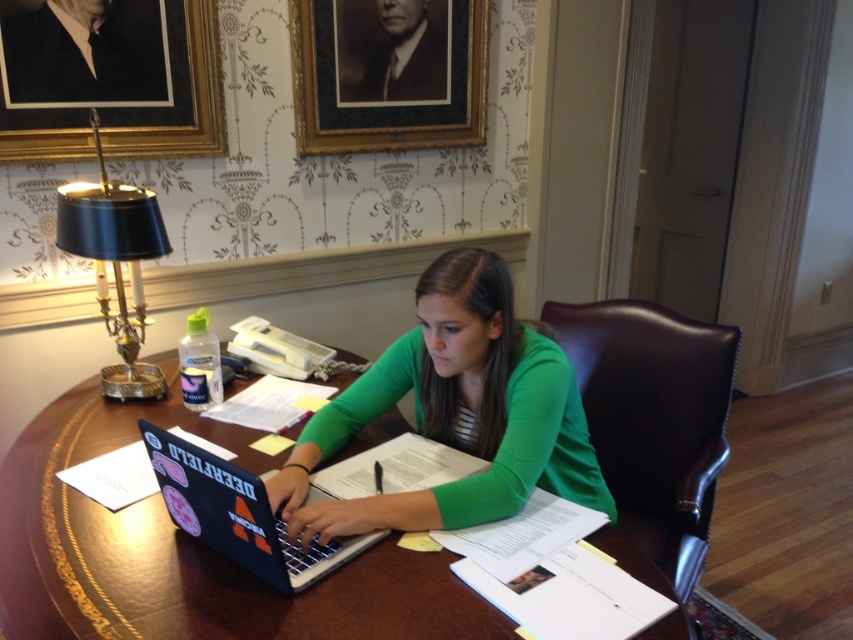
Can you confirm if wooden table at center is taller than matte black laptop at center?

Yes.

Does wooden table at center have a greater width compared to matte black laptop at center?

Yes.

Is point (49, 518) closer to viewer compared to point (207, 525)?

No, (49, 518) is further to viewer.

I want to click on wooden table at center, so click(187, 554).

Does gold framed portrait at upper center appear on the right side of gold/gilded picture frame at upper center?

Indeed, gold framed portrait at upper center is positioned on the right side of gold/gilded picture frame at upper center.

Can you confirm if gold framed portrait at upper center is smaller than gold/gilded picture frame at upper center?

Actually, gold framed portrait at upper center might be larger than gold/gilded picture frame at upper center.

Is point (456, 65) positioned behind point (62, 108)?

Yes, it is behind point (62, 108).

Identify the location of gold framed portrait at upper center. Image resolution: width=853 pixels, height=640 pixels. (387, 74).

Can you confirm if wooden table at center is shorter than gold framed portrait at upper center?

Correct, wooden table at center is not as tall as gold framed portrait at upper center.

Does wooden table at center appear under gold framed portrait at upper center?

Yes, wooden table at center is below gold framed portrait at upper center.

Find the location of a particular element. wooden table at center is located at coordinates (187, 554).